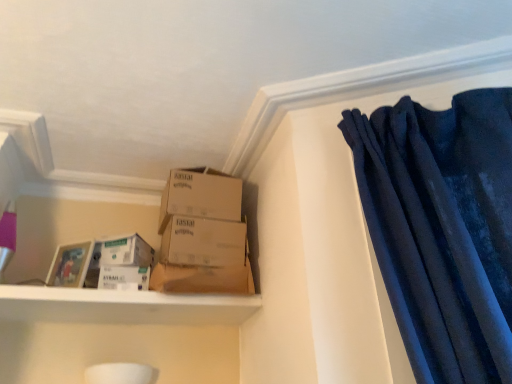
Image resolution: width=512 pixels, height=384 pixels. Identify the location of white matte shelf at lower left. (122, 306).

What are the coordinates of `brown cardboard box at center, which ranks as the first box in bottom-to-top order` in the screenshot? It's located at (203, 257).

This screenshot has width=512, height=384. In order to click on white cardboard box at lower left, placed as the 2th storage box when sorted from bottom to top in this screenshot , I will do `click(123, 252)`.

The height and width of the screenshot is (384, 512). Find the location of `white matte shelf at lower left`. white matte shelf at lower left is located at coordinates (122, 306).

Between white cardboard box at lower left, which is the 1th storage box in top-to-bottom order, and cardboard boxes at upper center, the 1th box when ordered from top to bottom, which one has larger width?

cardboard boxes at upper center, the 1th box when ordered from top to bottom, is wider.

Does white cardboard box at lower left, which is the 1th storage box in top-to-bottom order, touch cardboard boxes at upper center, the 1th box when ordered from top to bottom?

No, white cardboard box at lower left, which is the 1th storage box in top-to-bottom order, is not touching cardboard boxes at upper center, the 1th box when ordered from top to bottom.

From a real-world perspective, which object rests below the other?

white cardboard box at lower left, which is the 1th storage box in top-to-bottom order, from a real-world perspective.

Is the position of brown cardboard box at center, which ranks as the first box in bottom-to-top order, more distant than that of white matte shelf at lower left?

Yes, it is.

In the scene shown: Which is farther, (185,264) or (204,304)?

The point (204,304) is more distant.

From a real-world perspective, which object stands above the other?

From a 3D spatial view, brown cardboard box at center, the second box from the top, is above.

Identify the location of shelf on the left side of brown cardboard box at center, which ranks as the first box in bottom-to-top order. (122, 306).

In the scene shown: Considering the positions of objects white cardboard box at lower left, marked as the first storage box in a bottom-to-top arrangement, and white matte shelf at lower left in the image provided, who is more to the right, white cardboard box at lower left, marked as the first storage box in a bottom-to-top arrangement, or white matte shelf at lower left?

From the viewer's perspective, white matte shelf at lower left appears more on the right side.

Are white cardboard box at lower left, which is counted as the second storage box, starting from the top, and white matte shelf at lower left beside each other?

No, white cardboard box at lower left, which is counted as the second storage box, starting from the top, is not with white matte shelf at lower left.

From the image's perspective, between white cardboard box at lower left, marked as the first storage box in a bottom-to-top arrangement, and white matte shelf at lower left, who is located below?

white matte shelf at lower left is shown below in the image.

From a real-world perspective, does white matte shelf at lower left sit lower than brown cardboard box at center?

Yes.

From the image's perspective, who appears lower, white matte shelf at lower left or brown cardboard box at center?

white matte shelf at lower left.

Is the surface of white matte shelf at lower left in direct contact with brown cardboard box at center?

No.

Is white matte shelf at lower left to the left or to the right of brown cardboard box at center in the image?

white matte shelf at lower left is positioned on brown cardboard box at center's left side.

Is point (92, 254) less distant than point (144, 275)?

No, (92, 254) is behind (144, 275).

Is white cardboard box at lower left, placed as the 2th storage box when sorted from bottom to top, looking in the opposite direction of white cardboard box at lower left, marked as the first storage box in a bottom-to-top arrangement?

No.

Is the depth of white cardboard box at lower left, placed as the 2th storage box when sorted from bottom to top, greater than that of white cardboard box at lower left, which is counted as the second storage box, starting from the top?

Yes, white cardboard box at lower left, placed as the 2th storage box when sorted from bottom to top, is further from the viewer.

From the image's perspective, which is below, white cardboard box at lower left, which is the 1th storage box in top-to-bottom order, or white cardboard box at lower left, which is counted as the second storage box, starting from the top?

white cardboard box at lower left, which is counted as the second storage box, starting from the top.

Is white matte shelf at lower left positioned far away from brown cardboard box at center, the second box from the top?

No, white matte shelf at lower left is not far from brown cardboard box at center, the second box from the top.

Considering the points (11, 296) and (247, 261), which point is in front, point (11, 296) or point (247, 261)?

Positioned in front is point (11, 296).

Is white matte shelf at lower left in front of brown cardboard box at center, the second box from the top?

Yes, white matte shelf at lower left is closer to the viewer.

In the image, there is a brown cardboard box at center, which ranks as the first box in bottom-to-top order. Find the location of `shelf below it (from the image's perspective)`. shelf below it (from the image's perspective) is located at coordinates (122, 306).

Are brown cardboard box at center, the second box from the top, and white cardboard box at lower left, marked as the first storage box in a bottom-to-top arrangement, far apart?

They are positioned close to each other.

Is point (212, 273) positioned after point (148, 283)?

Yes.

In the image, is brown cardboard box at center, the second box from the top, positioned in front of or behind white cardboard box at lower left, which is counted as the second storage box, starting from the top?

brown cardboard box at center, the second box from the top, is in front of white cardboard box at lower left, which is counted as the second storage box, starting from the top.

Is brown cardboard box at center, the second box from the top, aimed at white cardboard box at lower left, which is counted as the second storage box, starting from the top?

No, brown cardboard box at center, the second box from the top, is not turned towards white cardboard box at lower left, which is counted as the second storage box, starting from the top.

Locate an element on the screen. This screenshot has width=512, height=384. the 2nd storage box counting from the left of the cardboard boxes at upper center, which ranks as the 2th box in bottom-to-top order is located at coordinates (123, 252).

I want to click on shelf in front of the brown cardboard box at center, which ranks as the first box in bottom-to-top order, so click(122, 306).

From the image, which object appears to be farther from velvet dark blue curtain at upper right, white matte shelf at lower left or white cardboard box at lower left, marked as the first storage box in a bottom-to-top arrangement?

white cardboard box at lower left, marked as the first storage box in a bottom-to-top arrangement, is positioned further to the anchor velvet dark blue curtain at upper right.

Looking at the image, which one is located further to white cardboard box at lower left, marked as the first storage box in a bottom-to-top arrangement, brown cardboard box at center or velvet dark blue curtain at upper right?

Among the two, velvet dark blue curtain at upper right is located further to white cardboard box at lower left, marked as the first storage box in a bottom-to-top arrangement.

From the image, which object appears to be nearer to white matte shelf at lower left, white cardboard box at lower left, placed as the 2th storage box when sorted from bottom to top, or brown cardboard box at center, the second box from the top?

brown cardboard box at center, the second box from the top, lies closer to white matte shelf at lower left than the other object.

Based on their spatial positions, is velvet dark blue curtain at upper right or white matte shelf at lower left closer to white cardboard box at lower left, which is the 1th storage box in top-to-bottom order?

Among the two, white matte shelf at lower left is located nearer to white cardboard box at lower left, which is the 1th storage box in top-to-bottom order.

From the image, which object appears to be farther from white cardboard box at lower left, marked as the first storage box in a bottom-to-top arrangement, white matte shelf at lower left or cardboard boxes at upper center, which ranks as the 2th box in bottom-to-top order?

The object further to white cardboard box at lower left, marked as the first storage box in a bottom-to-top arrangement, is cardboard boxes at upper center, which ranks as the 2th box in bottom-to-top order.

Estimate the real-world distances between objects in this image. Which object is closer to white cardboard box at lower left, placed as the 2th storage box when sorted from bottom to top, white matte shelf at lower left or velvet dark blue curtain at upper right?

→ The object closer to white cardboard box at lower left, placed as the 2th storage box when sorted from bottom to top, is white matte shelf at lower left.

Based on their spatial positions, is brown cardboard box at center, the second box from the top, or white cardboard box at lower left, marked as the first storage box in a bottom-to-top arrangement, further from brown cardboard box at center?

Among the two, white cardboard box at lower left, marked as the first storage box in a bottom-to-top arrangement, is located further to brown cardboard box at center.

From the image, which object appears to be nearer to velvet dark blue curtain at upper right, brown cardboard box at center, the second box from the top, or brown cardboard box at center?

brown cardboard box at center, the second box from the top, lies closer to velvet dark blue curtain at upper right than the other object.

Locate an element on the screen. This screenshot has width=512, height=384. shelf between white cardboard box at lower left, which is the 1th storage box in top-to-bottom order, and velvet dark blue curtain at upper right, in the horizontal direction is located at coordinates (122, 306).

The height and width of the screenshot is (384, 512). Find the location of `box between white cardboard box at lower left, marked as the first storage box in a bottom-to-top arrangement, and brown cardboard box at center, the second box from the top, from left to right`. box between white cardboard box at lower left, marked as the first storage box in a bottom-to-top arrangement, and brown cardboard box at center, the second box from the top, from left to right is located at coordinates click(200, 195).

Find the location of `cardboard box that lies between cardboard boxes at upper center, the 1th box when ordered from top to bottom, and white matte shelf at lower left from top to bottom`. cardboard box that lies between cardboard boxes at upper center, the 1th box when ordered from top to bottom, and white matte shelf at lower left from top to bottom is located at coordinates (202, 279).

Locate an element on the screen. storage box between white cardboard box at lower left, which is the 1th storage box in top-to-bottom order, and velvet dark blue curtain at upper right is located at coordinates (124, 277).